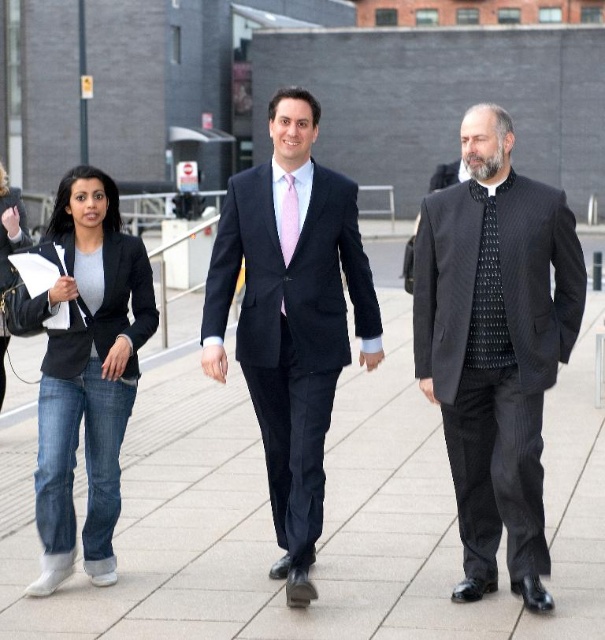
Question: Does paved stone pavement at center appear on the left side of black pinstripe suit at center?

Choices:
 (A) yes
 (B) no

Answer: (A)

Question: Which of these objects is positioned closest to the black pinstripe suit at center?

Choices:
 (A) matte black suit at center
 (B) paved stone pavement at center

Answer: (A)

Question: Among these objects, which one is nearest to the camera?

Choices:
 (A) matte black suit at center
 (B) denim jeans at left
 (C) pink silk tie at center

Answer: (A)

Question: Does black pinstripe suit at center appear over pink silk tie at center?

Choices:
 (A) no
 (B) yes

Answer: (A)

Question: Which of these objects is positioned farthest from the pink silk tie at center?

Choices:
 (A) matte black suit at center
 (B) paved stone pavement at center

Answer: (B)

Question: Is black pinstripe suit at center to the left of matte black suit at center from the viewer's perspective?

Choices:
 (A) no
 (B) yes

Answer: (A)